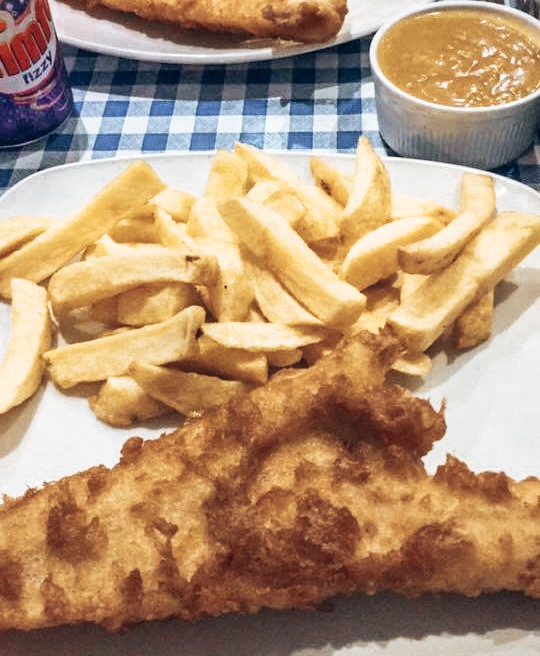
At what (x,y) coordinates should I click in order to perform the action: click on plate. Please return your answer as a coordinate pair (x, y). The image size is (540, 656). Looking at the image, I should click on (471, 414).